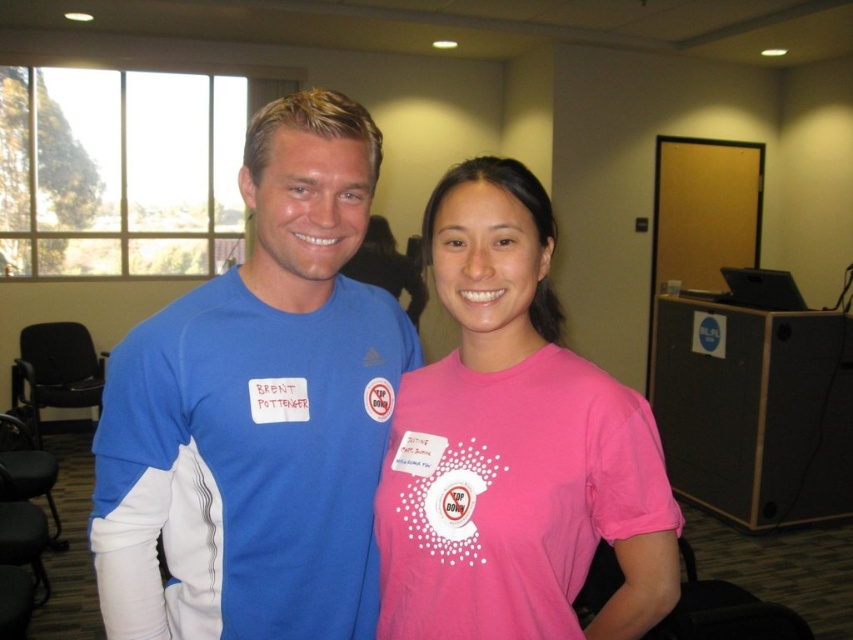
You are a photographer trying to capture a photo of the blue fabric shirt at left. The camera you are using has a focal length of 50mm. If the shirt is located at coordinates point 0.644, 0.304, can you estimate whether the shirt will be in the center of the photo or off to the side?

The blue fabric shirt at left is positioned at point (258, 412), which is not the center of the image. Therefore, the shirt will be off to the side in the photo.

You are a photographer setting up for a group photo. You have two shirts in the scene, the blue fabric shirt at left and the pink matte shirt at center. Which shirt should you focus on if you want to capture the larger one in your shot?

The blue fabric shirt at left is larger than the pink matte shirt at center, so you should focus on the blue fabric shirt at left to capture the larger one in your shot.

You are a photographer standing 10 feet away from the blue fabric shirt at left and the pink matte shirt at center. You want to capture both shirts in a single photo without moving the subjects. Can you fit both shirts into the frame if your camera has a maximum horizontal field of view of 8 inches?

The distance between the blue fabric shirt at left and the pink matte shirt at center is 7.91 inches, which is less than the camera maximum horizontal field of view of 8 inches. Therefore, both shirts can be captured in a single photo without moving the subjects.